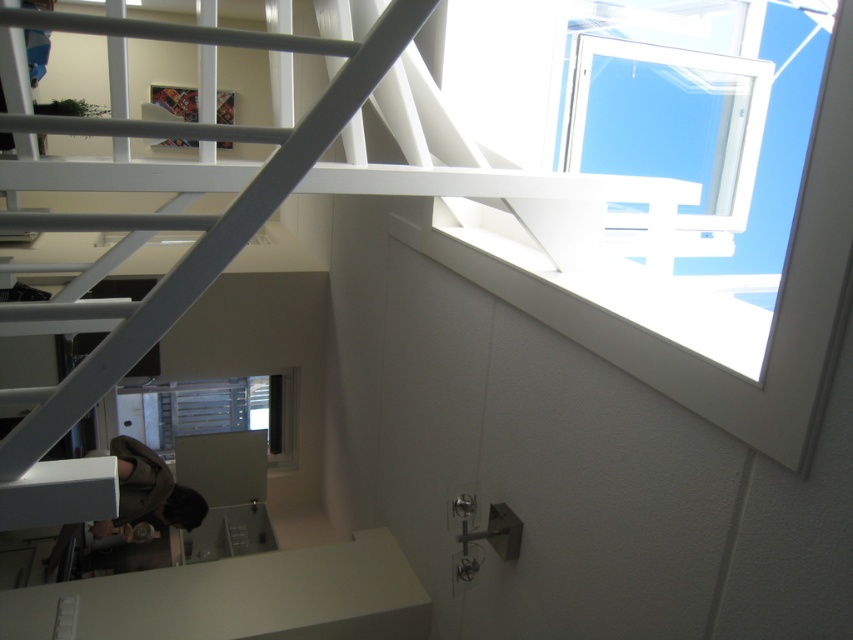
Question: Does white matte stair at upper right come behind clear glass window at center?

Choices:
 (A) yes
 (B) no

Answer: (B)

Question: Which object is the closest to the white matte stair at upper right?

Choices:
 (A) transparent glass window at upper right
 (B) clear glass window at center

Answer: (A)

Question: Among these points, which one is farthest from the camera?

Choices:
 (A) (201, 396)
 (B) (44, 408)
 (C) (572, 83)

Answer: (A)

Question: Does transparent glass window at upper right have a lesser width compared to white matte ladder at upper left?

Choices:
 (A) no
 (B) yes

Answer: (A)

Question: Does white matte ladder at upper left have a greater width compared to white matte stair at upper right?

Choices:
 (A) no
 (B) yes

Answer: (A)

Question: Based on their relative distances, which object is nearer to the white matte ladder at upper left?

Choices:
 (A) clear glass window at center
 (B) white matte stair at upper right
 (C) transparent glass window at upper right

Answer: (B)